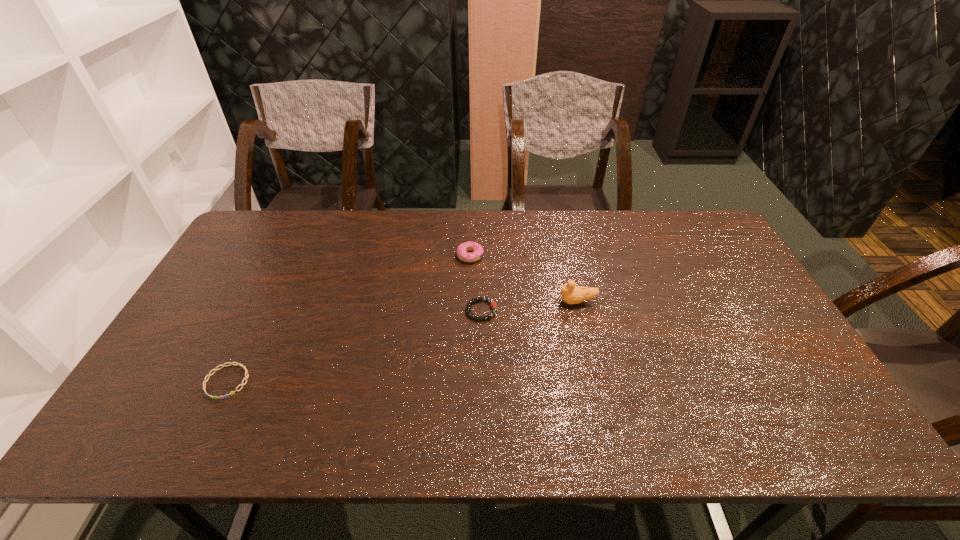
Where is `vacant space at the near left corner of the desktop`? This screenshot has height=540, width=960. vacant space at the near left corner of the desktop is located at coordinates (162, 422).

The height and width of the screenshot is (540, 960). Find the location of `vacant space at the far right corner`. vacant space at the far right corner is located at coordinates (709, 227).

The image size is (960, 540). What are the coordinates of `blank region between the nearer bracelet and the second tallest object` in the screenshot? It's located at (348, 319).

You are a GUI agent. You are given a task and a screenshot of the screen. Output one action in this format:
    pyautogui.click(x=<x>, y=<y>)
    Task: Click on the free space that is in between the rightmost object and the third shortest object
    The width and height of the screenshot is (960, 540).
    Given the screenshot: What is the action you would take?
    pyautogui.click(x=524, y=279)

This screenshot has width=960, height=540. In order to click on vacant space in between the doughnut and the nearest object in this screenshot , I will do `click(348, 319)`.

I want to click on free space between the nearest object and the duckling, so click(x=402, y=342).

Find the location of a particular element. vacant point located between the nearer bracelet and the rightmost object is located at coordinates (402, 342).

The width and height of the screenshot is (960, 540). I want to click on free space between the nearest object and the duckling, so click(402, 342).

Identify the location of vacant area between the farther bracelet and the rightmost object. The height and width of the screenshot is (540, 960). (530, 306).

Image resolution: width=960 pixels, height=540 pixels. What are the coordinates of `blank region between the third shortest object and the nearest object` in the screenshot? It's located at (348, 319).